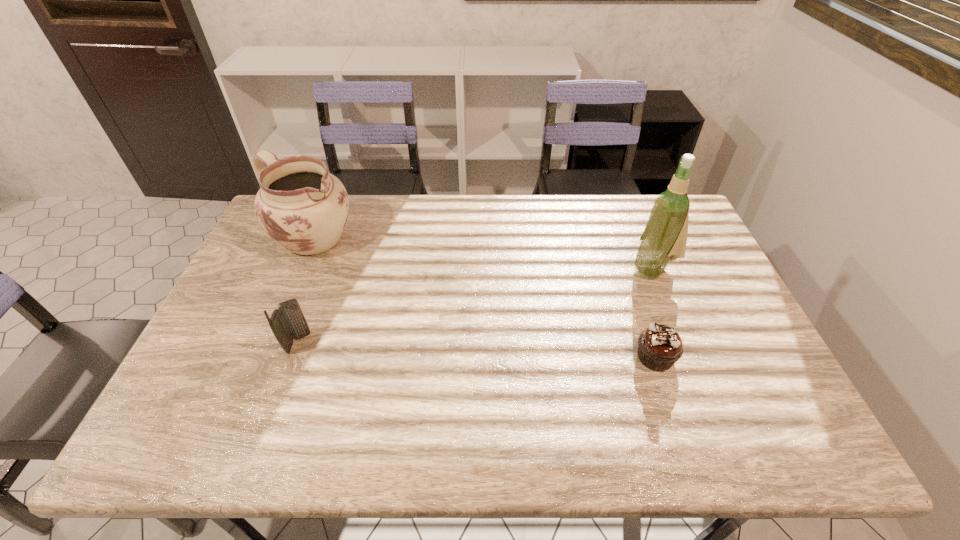
Identify the location of free space on the desktop that is between the cellular telephone and the shortest object and is positioned on the spout of the second tallest object. The image size is (960, 540). 441,348.

This screenshot has height=540, width=960. I want to click on free space on the desktop that is between the cellular telephone and the cupcake and is positioned on the front-facing side of the wine bottle, so click(497, 350).